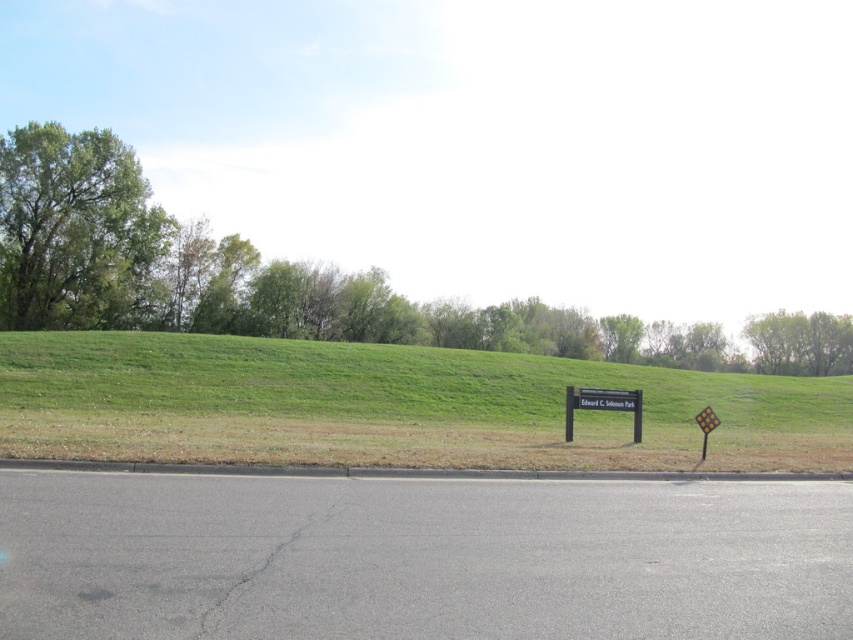
Between green leafy tree at upper right and yellow reflective plastic at right, which one has less height?

Standing shorter between the two is yellow reflective plastic at right.

What do you see at coordinates (799, 342) in the screenshot? I see `green leafy tree at upper right` at bounding box center [799, 342].

Locate an element on the screen. The width and height of the screenshot is (853, 640). green leafy tree at upper right is located at coordinates (799, 342).

The image size is (853, 640). I want to click on green leafy tree at upper right, so pos(799,342).

Is green grassy hillside at center further to camera compared to black plastic sign at center?

No, green grassy hillside at center is in front of black plastic sign at center.

Does green grassy hillside at center appear under black plastic sign at center?

Correct, green grassy hillside at center is located below black plastic sign at center.

Is point (503, 445) in front of point (579, 394)?

Yes, point (503, 445) is in front of point (579, 394).

Where is `green grassy hillside at center`? The width and height of the screenshot is (853, 640). green grassy hillside at center is located at coordinates (392, 406).

Is green leafy tree at upper left positioned before yellow reflective plastic at right?

No, it is behind yellow reflective plastic at right.

Between green leafy tree at upper left and yellow reflective plastic at right, which one appears on the right side from the viewer's perspective?

Positioned to the right is yellow reflective plastic at right.

Between point (347, 314) and point (711, 417), which one is positioned behind?

Positioned behind is point (347, 314).

At what (x,y) coordinates should I click in order to perform the action: click on green leafy tree at upper left. Please return your answer as a coordinate pair (x, y). Looking at the image, I should click on (247, 273).